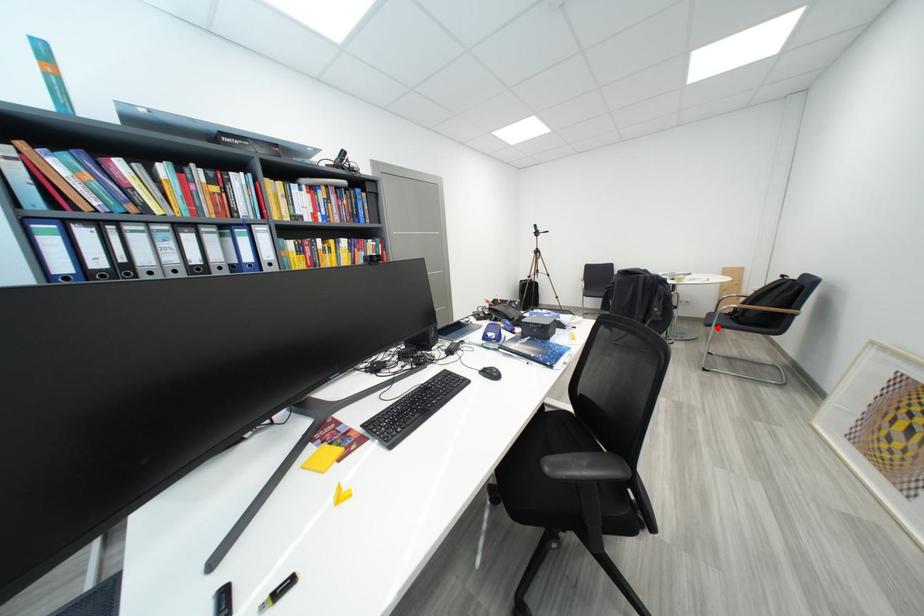
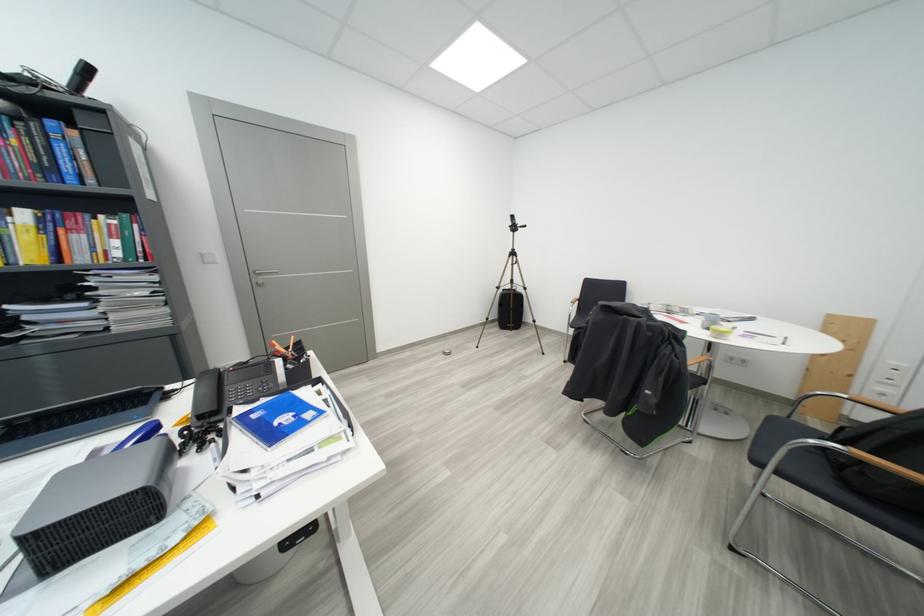
Question: I am providing you with two images of the same scene from different viewpoints. A red point is shown in image1. For the corresponding object point in image2, is it positioned nearer or farther from the camera?

Choices:
 (A) Nearer
 (B) Farther

Answer: (B)